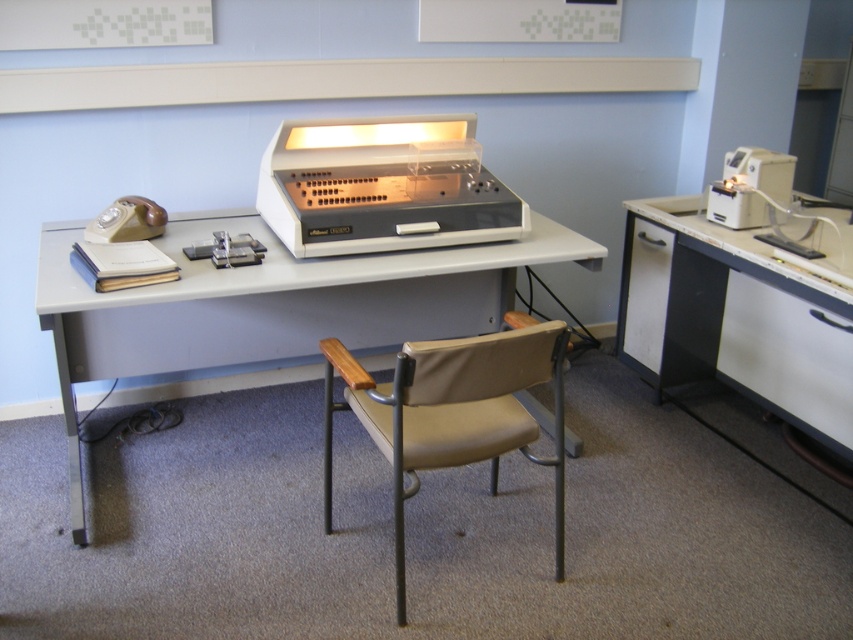
You are a person of average height standing in the workspace. You need to reach for the beige plastic telephone at left while sitting in the beige fabric swivel chair at center. Will you be able to reach it without leaving the chair?

The beige fabric swivel chair at center has a greater height compared to beige plastic telephone at left, so when sitting in the chair, your arms would likely be at a lower level than the telephone, making it easy to reach without leaving the chair.

You are setting up a new monitor that requires a desk surface at least 1.2 meters in height. Given the white glossy computer desk at right and the beige plastic telephone at left, which object meets the height requirement?

The white glossy computer desk at right is taller than the beige plastic telephone at left, so the desk meets the height requirement for the monitor.